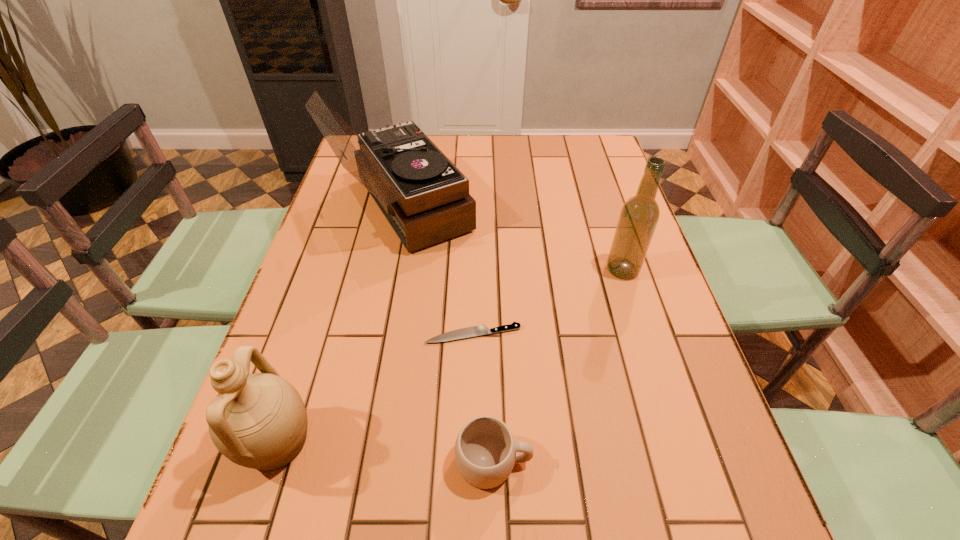
Where is `vacant area between the pitcher and the rightmost object`? This screenshot has height=540, width=960. vacant area between the pitcher and the rightmost object is located at coordinates (449, 356).

You are a GUI agent. You are given a task and a screenshot of the screen. Output one action in this format:
    pyautogui.click(x=<x>, y=<y>)
    Task: Click on the object that is the nearest to the record player
    
    Given the screenshot: What is the action you would take?
    pyautogui.click(x=479, y=330)

Where is `object that is the third closest to the shortest object`? The width and height of the screenshot is (960, 540). object that is the third closest to the shortest object is located at coordinates (259, 421).

The height and width of the screenshot is (540, 960). In order to click on free space that satisfies the following two spatial constraints: 1. on the front side of the record player; 2. on the left side of the liquor in this screenshot , I will do coord(389,269).